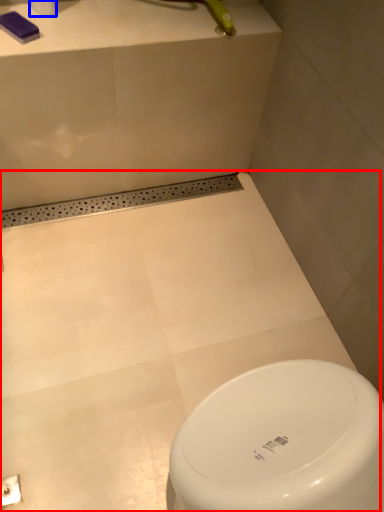
Question: Which object is further to the camera taking this photo, bath (highlighted by a red box) or toilet paper (highlighted by a blue box)?

Choices:
 (A) bath
 (B) toilet paper

Answer: (B)